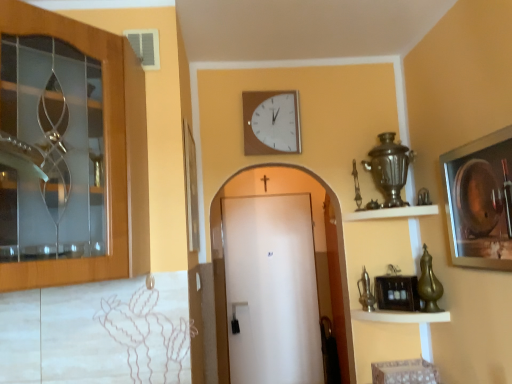
Question: Is metallic silver picture frame at right situated inside white wooden clock at upper center or outside?

Choices:
 (A) inside
 (B) outside

Answer: (B)

Question: Visually, is metallic silver picture frame at right positioned to the left or to the right of white wooden clock at upper center?

Choices:
 (A) right
 (B) left

Answer: (A)

Question: Estimate the real-world distances between objects in this image. Which object is closer to the white matte door at center, the first door viewed from the back?

Choices:
 (A) wooden cabinet at left, which appears as the 1th door when viewed from the left
 (B) metallic silver picture frame at right
 (C) white wooden clock at upper center
 (D) metallic brass shelf at lower right, which is the 2th shelf from top to bottom
 (E) white wooden shelf at upper right, the first shelf in the top-to-bottom sequence

Answer: (C)

Question: Which object is the closest to the white matte door at center, which appears as the 2th door when viewed from the left?

Choices:
 (A) white wooden shelf at upper right, the first shelf in the top-to-bottom sequence
 (B) white wooden clock at upper center
 (C) metallic brass shelf at lower right, arranged as the 1th shelf when ordered from the bottom
 (D) wooden cabinet at left, the 2th door in the bottom-to-top sequence
 (E) metallic silver picture frame at right

Answer: (B)